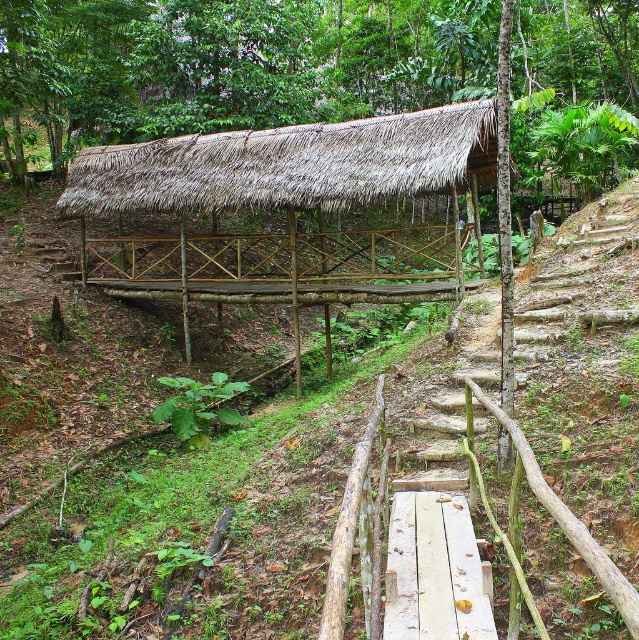
You are planning to hang a large decorative banner between the thatched roof hut at upper center and the thatched roof shelter at center. Given their heights, which structure should the banner be anchored to at the higher point?

The banner should be anchored to the thatched roof hut at upper center at the higher point since it has a greater height compared to the thatched roof shelter at center.

You are standing on the wooden walkway in front of the thatched roof hut. There is a specific point marked at coordinates point (233, 64). Where is this point located in relation to the thatched roof hut?

The point (233, 64) is located on the thatched roof hut at upper center.